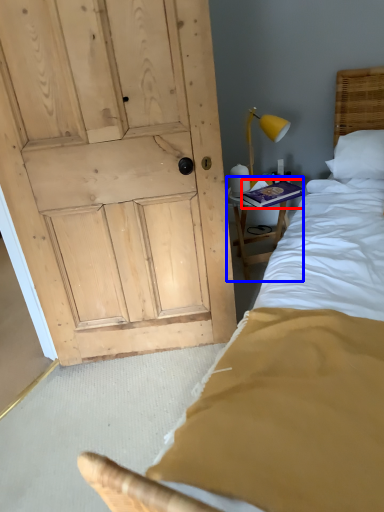
Question: Which object is closer to the camera taking this photo, book (highlighted by a red box) or furniture (highlighted by a blue box)?

Choices:
 (A) book
 (B) furniture

Answer: (A)